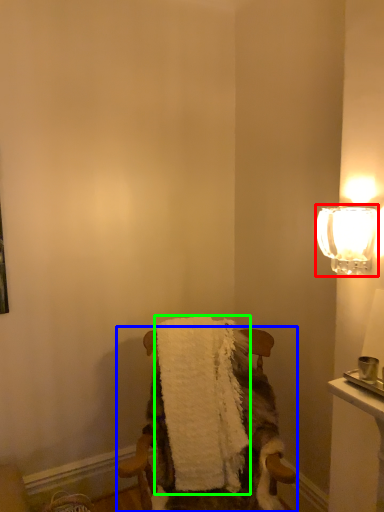
Question: Based on their relative distances, which object is nearer to lamp (highlighted by a red box)? Choose from chair (highlighted by a blue box) and bath towel (highlighted by a green box).

Choices:
 (A) chair
 (B) bath towel

Answer: (A)